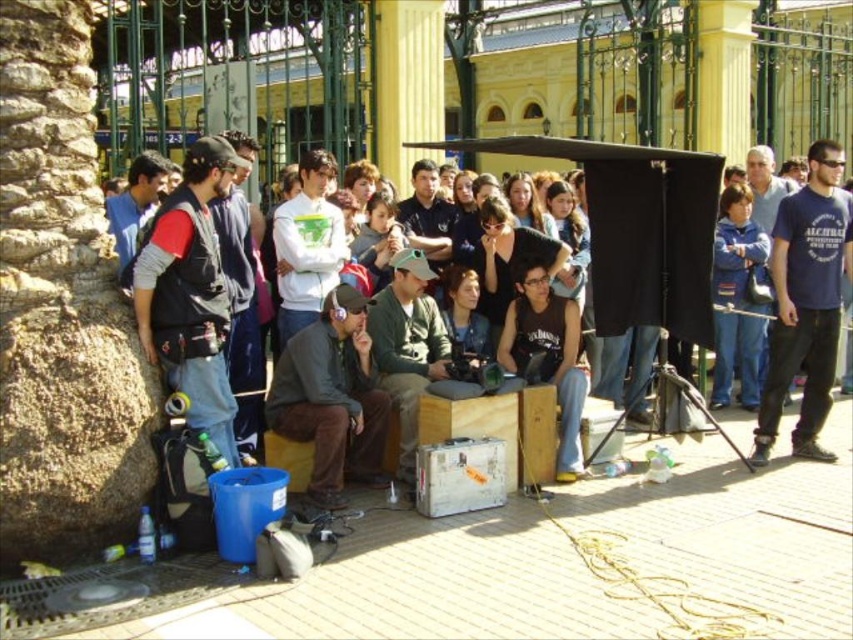
You are organizing a small event in this outdoor area and need to arrange seating. You have two items to place on the ground near the large rock on the left side. The white matte hoodie at center and the dark gray jacket at center. Since you want to maximize space efficiency, which item should you choose to take up less space?

The white matte hoodie at center occupies less space than the dark gray jacket at center, so you should choose the white matte hoodie at center to take up less space and maximize space efficiency.